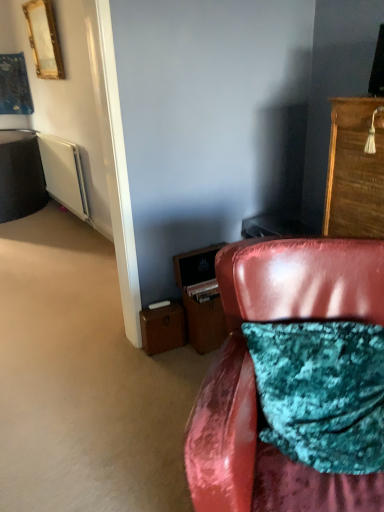
Identify the location of free location to the left of brown leather suitcase at lower left, which ranks as the 1th drawer in left-to-right order. (124, 356).